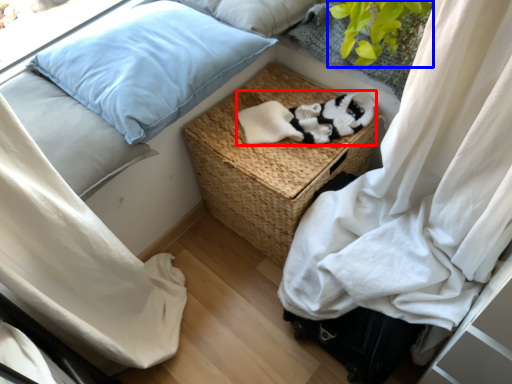
Question: Which point is closer to the camera, clothing (highlighted by a red box) or plant (highlighted by a blue box)?

Choices:
 (A) clothing
 (B) plant

Answer: (B)